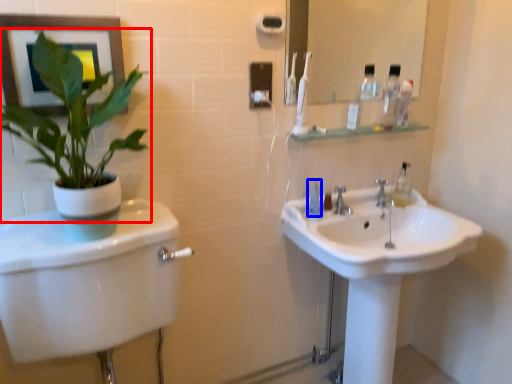
Question: Which object is further to the camera taking this photo, houseplant (highlighted by a red box) or mouthwash (highlighted by a blue box)?

Choices:
 (A) houseplant
 (B) mouthwash

Answer: (B)